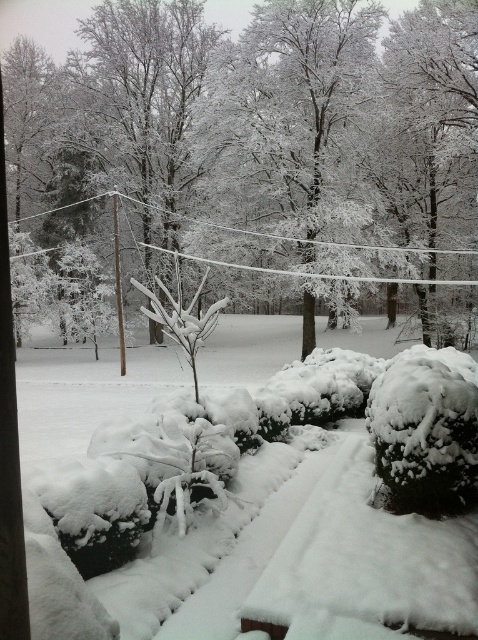
Does white frosty tree at center have a greater height compared to white fluffy snow at center?

Correct, white frosty tree at center is much taller as white fluffy snow at center.

How much distance is there between white frosty tree at center and white fluffy snow at center?

white frosty tree at center is 32.05 feet from white fluffy snow at center.

Is point (289, 100) farther from viewer compared to point (162, 371)?

That is True.

Where is `white frosty tree at center`? This screenshot has width=478, height=640. white frosty tree at center is located at coordinates (274, 138).